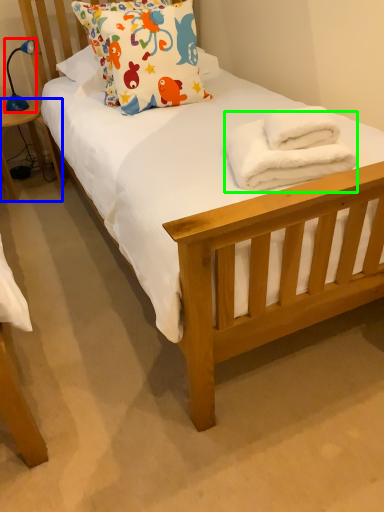
Question: Considering the real-world distances, which object is farthest from lamp (highlighted by a red box)? table (highlighted by a blue box) or bath towel (highlighted by a green box)?

Choices:
 (A) table
 (B) bath towel

Answer: (B)